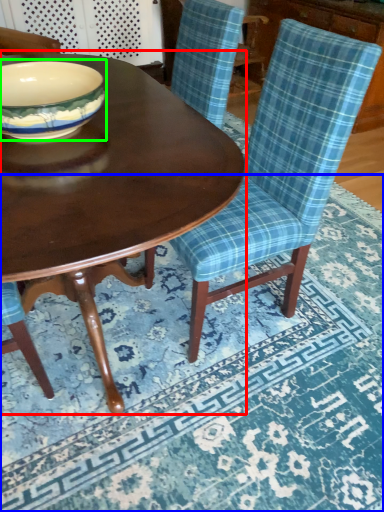
Question: Which is nearer to the coffee table (highlighted by a red box)? place mat (highlighted by a blue box) or bowl (highlighted by a green box).

Choices:
 (A) place mat
 (B) bowl

Answer: (B)